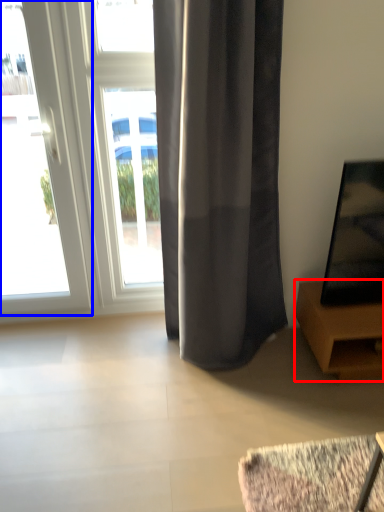
Question: Which of the following is the farthest to the observer, furniture (highlighted by a red box) or door (highlighted by a blue box)?

Choices:
 (A) furniture
 (B) door

Answer: (A)